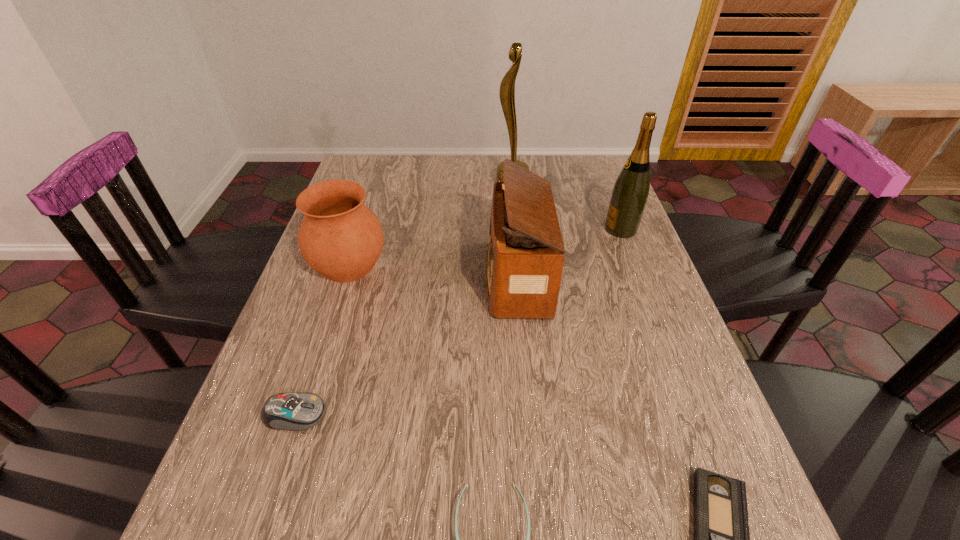
Identify the location of empty space that is in between the pottery and the fifth farthest object. The width and height of the screenshot is (960, 540). (322, 340).

You are a GUI agent. You are given a task and a screenshot of the screen. Output one action in this format:
    pyautogui.click(x=<x>, y=<y>)
    Task: Click on the unoccupied area between the fifth farthest object and the fourth tallest object
    
    Given the screenshot: What is the action you would take?
    pyautogui.click(x=322, y=340)

Locate an element on the screen. This screenshot has height=540, width=960. object that can be found as the fourth closest to the radio receiver is located at coordinates (298, 411).

Choose which object is the second nearest neighbor to the third nearest object. Please provide its 2D coordinates. Your answer should be formatted as a tuple, i.e. [(x, y)], where the tuple contains the x and y coordinates of a point satisfying the conditions above.

[(341, 238)]

I want to click on vacant space that satisfies the following two spatial constraints: 1. on the front side of the pottery; 2. on the wheel side of the computer mouse, so click(300, 415).